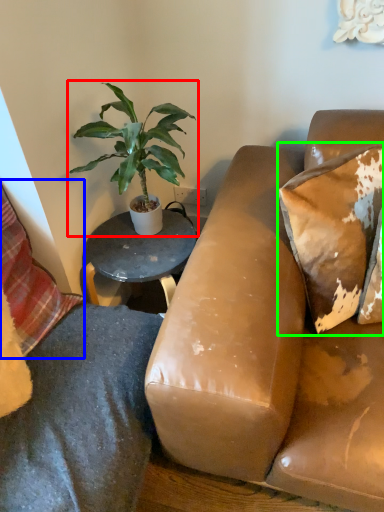
Question: Considering the real-world distances, which object is farthest from houseplant (highlighted by a red box)? pillow (highlighted by a blue box) or pillow (highlighted by a green box)?

Choices:
 (A) pillow
 (B) pillow

Answer: (B)